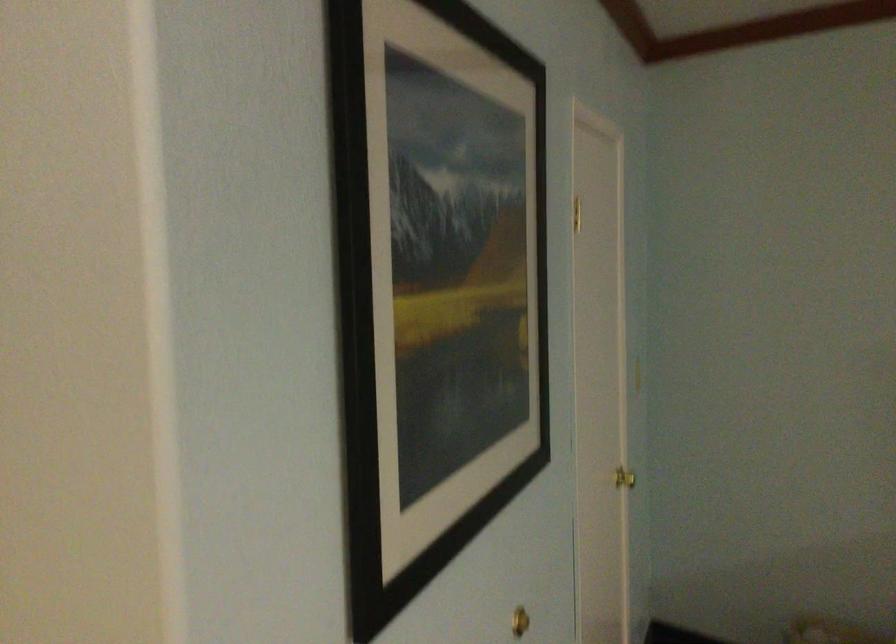
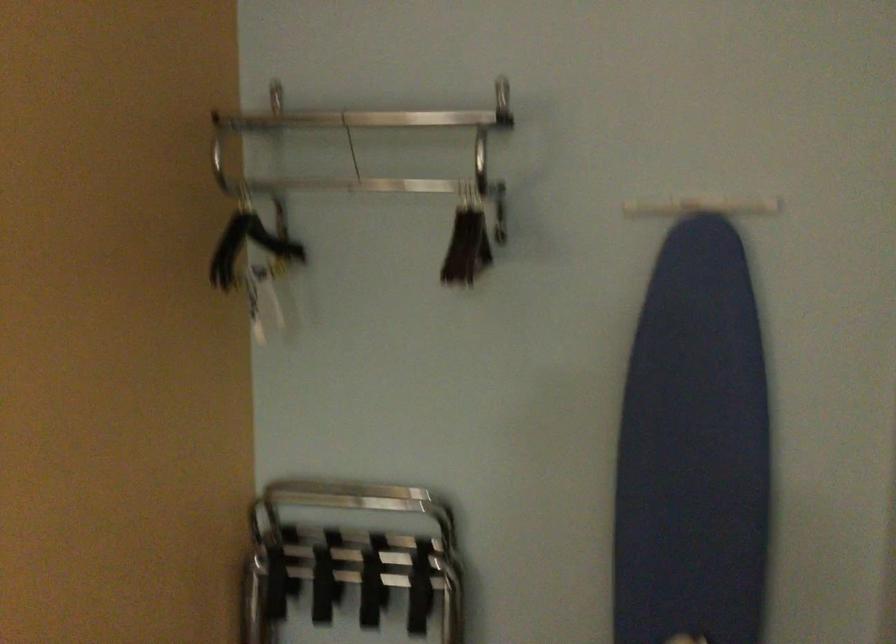
Question: How did the camera likely rotate?

Choices:
 (A) Left
 (B) Right
 (C) Up
 (D) Down

Answer: (A)